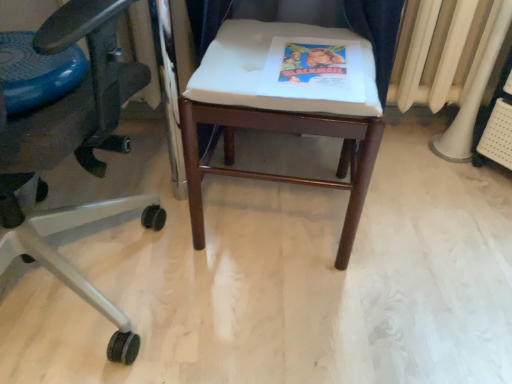
At what (x,y) coordinates should I click in order to perform the action: click on empty space that is to the right of matte black office chair at left. Please return your answer as a coordinate pair (x, y). The width and height of the screenshot is (512, 384). Looking at the image, I should click on (269, 318).